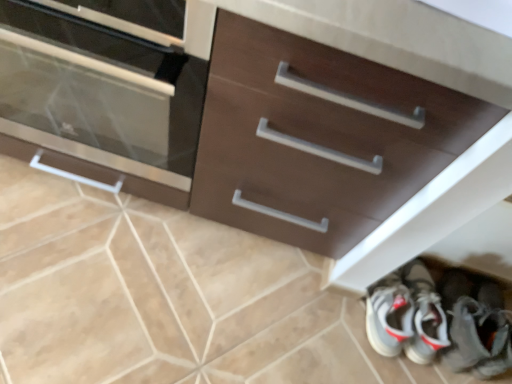
Question: Is matte brown cabinet at left wider than white leather sneakers at lower right?

Choices:
 (A) no
 (B) yes

Answer: (B)

Question: Is matte brown cabinet at left at the right side of white leather sneakers at lower right?

Choices:
 (A) no
 (B) yes

Answer: (A)

Question: Considering the relative sizes of matte brown cabinet at left and white leather sneakers at lower right in the image provided, is matte brown cabinet at left bigger than white leather sneakers at lower right?

Choices:
 (A) yes
 (B) no

Answer: (A)

Question: Can you confirm if matte brown cabinet at left is thinner than white leather sneakers at lower right?

Choices:
 (A) yes
 (B) no

Answer: (B)

Question: Is matte brown cabinet at left looking in the opposite direction of white leather sneakers at lower right?

Choices:
 (A) yes
 (B) no

Answer: (B)

Question: Would you say beige ceramic tile at lower center is to the left or to the right of matte brown cabinet at left in the picture?

Choices:
 (A) right
 (B) left

Answer: (A)

Question: In terms of width, does beige ceramic tile at lower center look wider or thinner when compared to matte brown cabinet at left?

Choices:
 (A) thin
 (B) wide

Answer: (A)

Question: From the image's perspective, is beige ceramic tile at lower center located above or below matte brown cabinet at left?

Choices:
 (A) below
 (B) above

Answer: (A)

Question: In terms of height, does beige ceramic tile at lower center look taller or shorter compared to matte brown cabinet at left?

Choices:
 (A) short
 (B) tall

Answer: (A)

Question: From the image's perspective, is white leather sneakers at lower right located above or below matte brown cabinet at left?

Choices:
 (A) above
 (B) below

Answer: (B)

Question: In the image, is white leather sneakers at lower right positioned in front of or behind matte brown cabinet at left?

Choices:
 (A) front
 (B) behind

Answer: (B)

Question: Considering the positions of white leather sneakers at lower right and matte brown cabinet at left in the image, is white leather sneakers at lower right wider or thinner than matte brown cabinet at left?

Choices:
 (A) wide
 (B) thin

Answer: (B)

Question: From a real-world perspective, relative to matte brown cabinet at left, is white leather sneakers at lower right vertically above or below?

Choices:
 (A) above
 (B) below

Answer: (B)

Question: From the image's perspective, is matte brown cabinet at left located above or below beige ceramic tile at lower center?

Choices:
 (A) above
 (B) below

Answer: (A)

Question: Considering the positions of matte brown cabinet at left and beige ceramic tile at lower center in the image, is matte brown cabinet at left taller or shorter than beige ceramic tile at lower center?

Choices:
 (A) tall
 (B) short

Answer: (A)